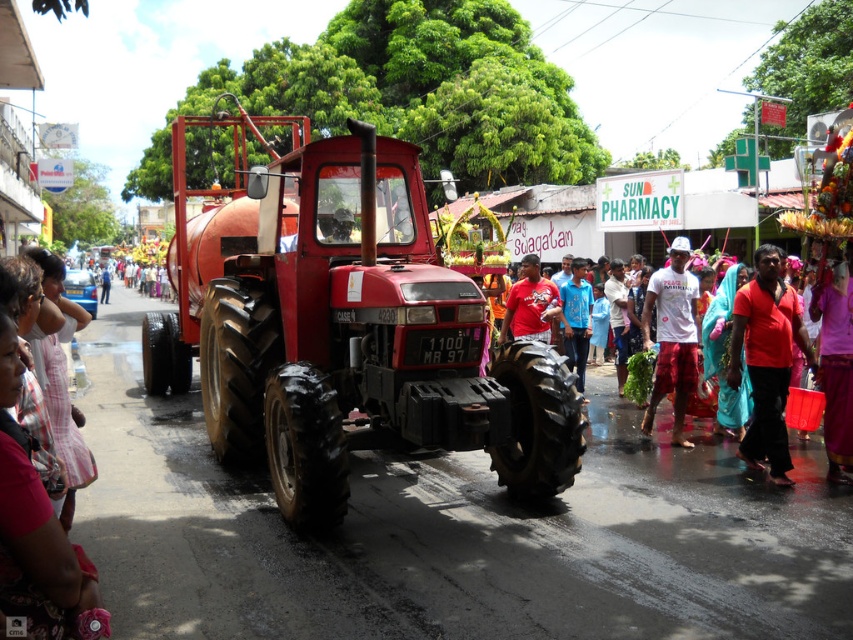
Question: Which point is farther from the camera taking this photo?

Choices:
 (A) (679, 342)
 (B) (235, 412)
 (C) (793, 324)

Answer: (A)

Question: Which is farther from the matte red shirt at center?

Choices:
 (A) red matte shirt at center
 (B) white matte t-shirt at center
 (C) matte red tractor at center

Answer: (C)

Question: In this image, where is red fabric cloth at center located relative to red matte shirt at center?

Choices:
 (A) below
 (B) above

Answer: (A)

Question: Is red matte shirt at center to the left of matte red shirt at center from the viewer's perspective?

Choices:
 (A) yes
 (B) no

Answer: (B)

Question: Which point is closer to the camera taking this photo?

Choices:
 (A) tap(653, 301)
 (B) tap(572, 340)
 (C) tap(531, 324)
 (D) tap(780, 340)

Answer: (D)

Question: Can you confirm if red fabric cloth at center is positioned to the right of matte red shirt at center?

Choices:
 (A) yes
 (B) no

Answer: (A)